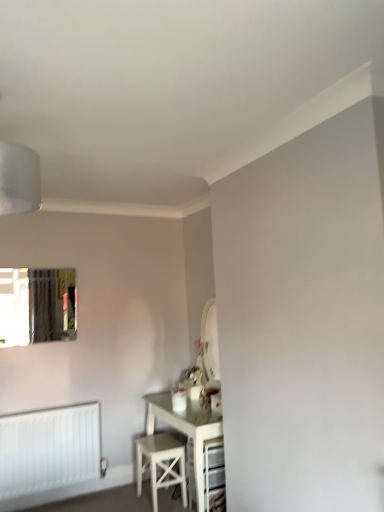
Question: Would you say clear glass mirror at upper left is inside or outside white wood stool at lower center?

Choices:
 (A) outside
 (B) inside

Answer: (A)

Question: From their relative heights in the image, would you say clear glass mirror at upper left is taller or shorter than white wood stool at lower center?

Choices:
 (A) tall
 (B) short

Answer: (A)

Question: Which object is positioned farthest from the clear glass mirror at upper left?

Choices:
 (A) white wood stool at lower center
 (B) white matte radiator at lower left

Answer: (A)

Question: Which is nearer to the white wood stool at lower center?

Choices:
 (A) white matte radiator at lower left
 (B) clear glass mirror at upper left

Answer: (A)